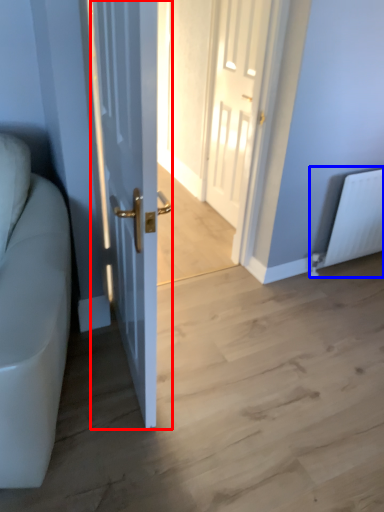
Question: Which object is further to the camera taking this photo, door (highlighted by a red box) or radiator (highlighted by a blue box)?

Choices:
 (A) door
 (B) radiator

Answer: (B)